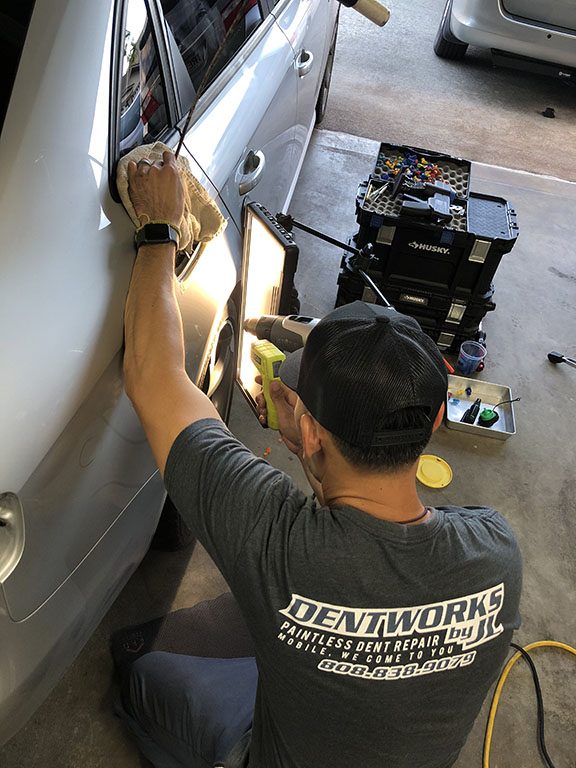
Where is `black cord`? The image size is (576, 768). black cord is located at coordinates (539, 703).